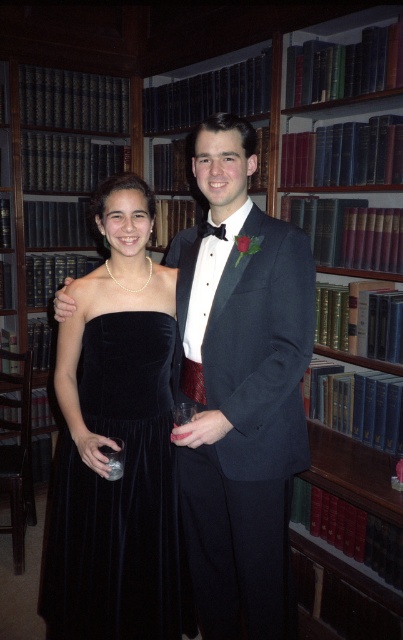
You are a photographer at this event and need to adjust the lighting on the hardcover books at center and the black hardcover books at left. Which of these two objects is located directly above the other?

The black hardcover books at left are positioned directly above the hardcover books at center.

You are a photographer setting up for a prom photo shoot. You have a velvet black dress at center and black hardcover books at left. Which object is narrower when viewed from the front?

The velvet black dress at center is thinner than the black hardcover books at left, so the velvet black dress at center is narrower.